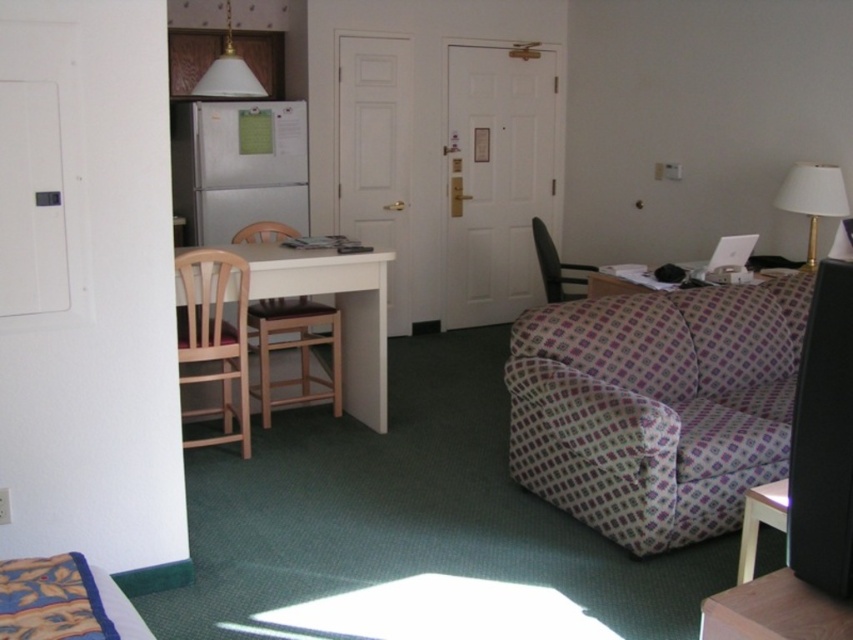
You are a delivery person trying to place a large pizza box that is 12 inches wide on the table. Can the pizza box fit on the white wood table at center if it is placed next to the brown wood chair at left?

The white wood table at center is 11.79 inches from the brown wood chair at left, which means there isn not enough space to place the 12 inches wide pizza box next to the chair. The pizza box would not fit.

You are a guest in this room and need to place a large rectangular box that measures 1.2 meters in length. Which table, the white wood table at center or the wooden table at lower right, can accommodate this box without it hanging over the edges?

The white wood table at center is larger in size than the wooden table at lower right, so the large rectangular box measuring 1.2 meters in length can be placed on the white wood table at center without hanging over the edges.